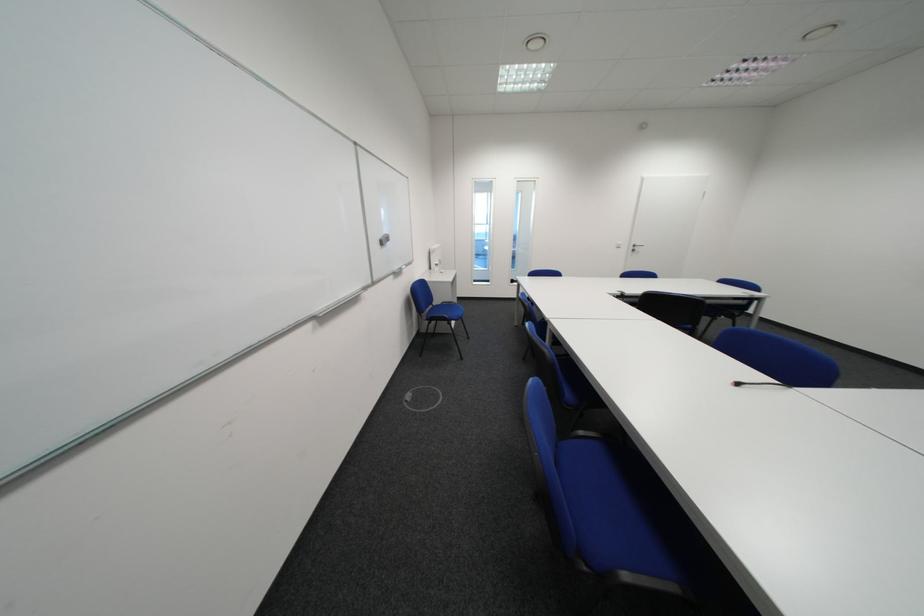
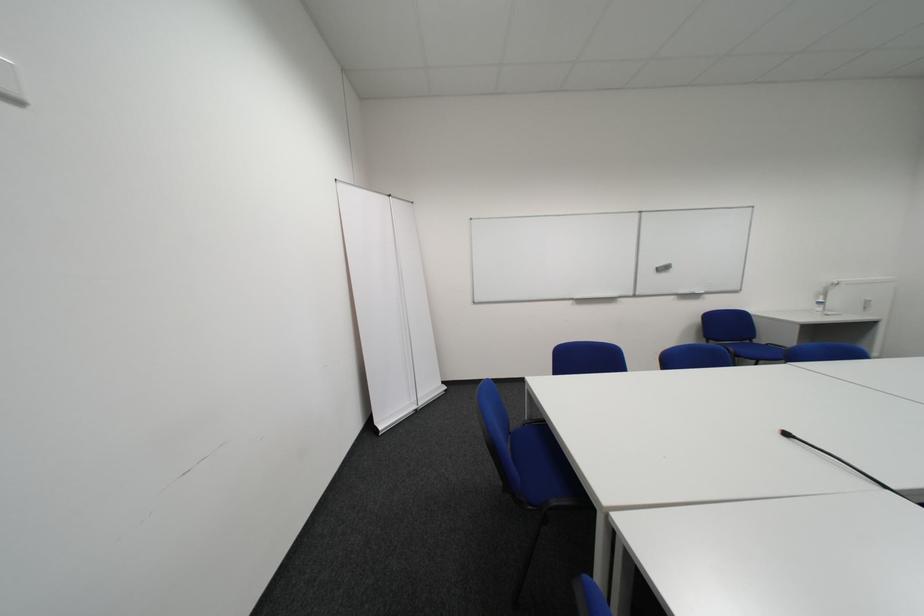
Question: I am providing you with two images of the same scene from different viewpoints. After the viewpoint changes to image2, which objects are now occluded?

Choices:
 (A) black wall hook
 (B) whiteboard eraser
 (C) blue chair sitting surface
 (D) plastic water bottle

Answer: (C)